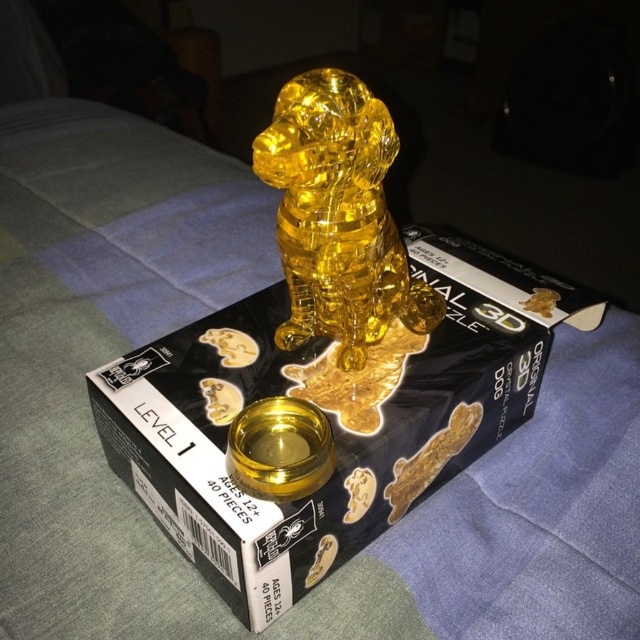
You are a customer at a toy store looking at the packaging of the 3D crystal puzzle. You notice the translucent yellow plastic at center and the translucent yellow crystal dog at center. Which object takes up more space on the packaging box?

The translucent yellow plastic at center is larger in size than the translucent yellow crystal dog at center, so it takes up more space on the packaging box.

You are trying to assemble the 3D crystal puzzle of a dog. The puzzle pieces form the dog and a bowl. Based on the image, which object is closer to you, the translucent yellow crystal dog at center or the gold shiny bowl at center?

The translucent yellow crystal dog at center is closer to you because it is in front of the gold shiny bowl at center.